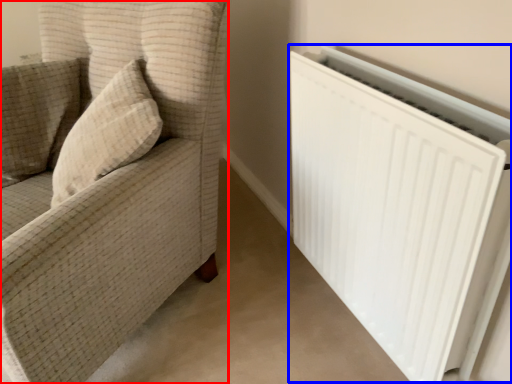
Question: Which object appears closest to the camera in this image, furniture (highlighted by a red box) or radiator (highlighted by a blue box)?

Choices:
 (A) furniture
 (B) radiator

Answer: (A)